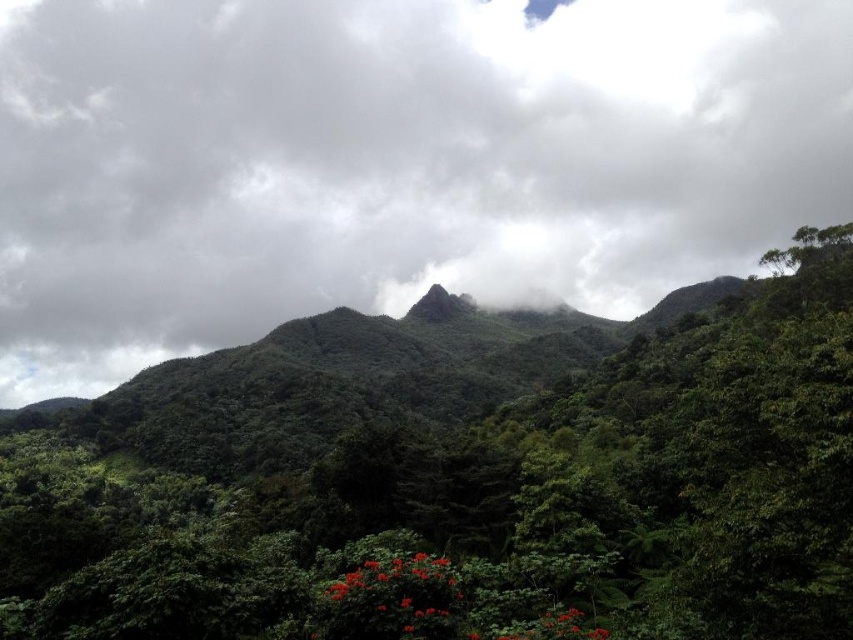
Between cloudy sky at center and green leafy tree at center, which one has more height?

cloudy sky at center

In the scene shown: Who is shorter, cloudy sky at center or green leafy tree at center?

green leafy tree at center is shorter.

Image resolution: width=853 pixels, height=640 pixels. What are the coordinates of `cloudy sky at center` in the screenshot? It's located at (392, 161).